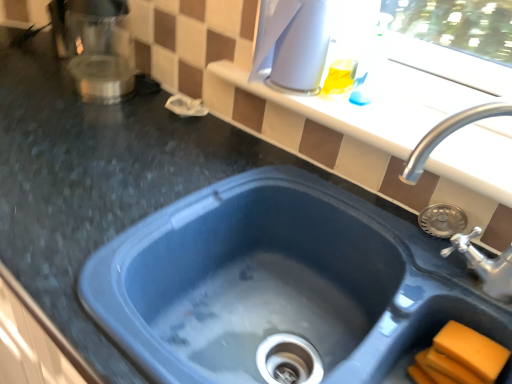
You are a GUI agent. You are given a task and a screenshot of the screen. Output one action in this format:
    pyautogui.click(x=<x>, y=<y>)
    Task: Click on the free spot to the right of satin silver coffee maker at upper left, which is the first appliance from left to right
    Image resolution: width=512 pixels, height=384 pixels.
    Given the screenshot: What is the action you would take?
    pyautogui.click(x=148, y=120)